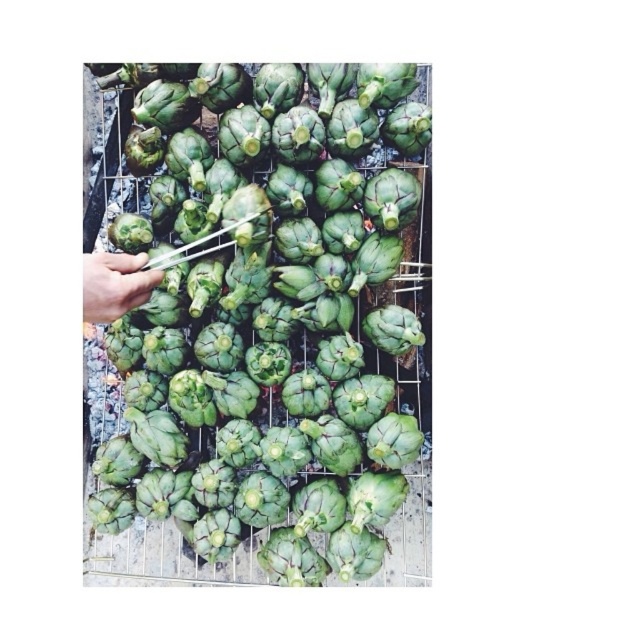
Does green matte artichoke at center have a lesser height compared to smooth green artichoke at left?

In fact, green matte artichoke at center may be taller than smooth green artichoke at left.

Which of these two, green matte artichoke at center or smooth green artichoke at left, stands taller?

green matte artichoke at center

You are a GUI agent. You are given a task and a screenshot of the screen. Output one action in this format:
    pyautogui.click(x=<x>, y=<y>)
    Task: Click on the green matte artichoke at center
    The width and height of the screenshot is (640, 640).
    Given the screenshot: What is the action you would take?
    pyautogui.click(x=268, y=346)